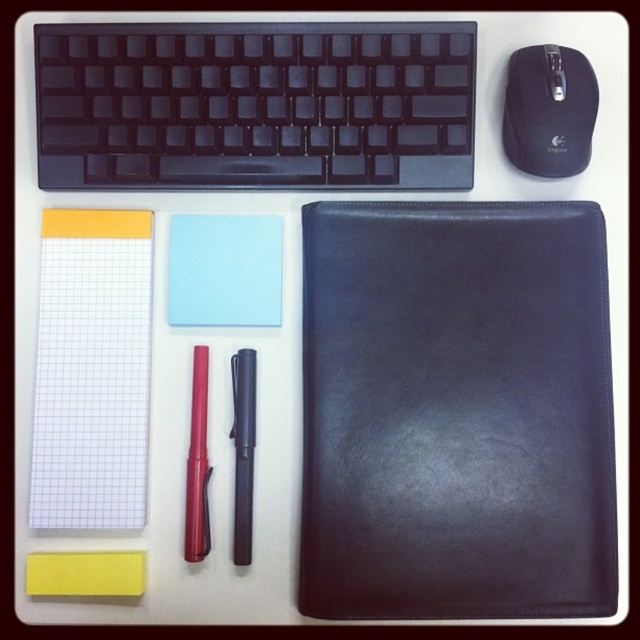
You are organizing your desk and want to place a new pen holder. The light blue sticky note is at point (225,269). Where should you place the pen holder so that it is directly to the right of the light blue sticky note?

The pen holder should be placed to the right of the light blue sticky note at point (225,269). Since the light blue sticky note is at that coordinate, placing the pen holder to its right would mean positioning it at a coordinate with a higher x value than 0.423 while maintaining the same y value of 0.352.

You are organizing your desk and need to place a new item between the light blue paper at center and the black matte mouse at upper right. Based on their positions, which object is closer to you so you can place the new item accordingly?

The light blue paper at center is closer to you than the black matte mouse at upper right, so you should place the new item between them starting from the light blue paper at center side.